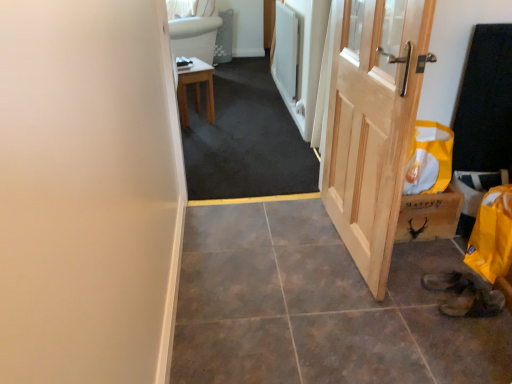
Locate an element on the screen. wooden stool at center is located at coordinates (195, 89).

The height and width of the screenshot is (384, 512). Describe the element at coordinates (181, 8) in the screenshot. I see `white fabric curtain at upper center` at that location.

This screenshot has width=512, height=384. What are the coordinates of `brown leather shoe at lower right` in the screenshot? It's located at (474, 303).

This screenshot has width=512, height=384. What do you see at coordinates (373, 123) in the screenshot?
I see `natural wood door at right` at bounding box center [373, 123].

Find the location of a particular element. wooden stool at center is located at coordinates (195, 89).

Which object is closer to the camera taking this photo, brown leather shoe at lower right or natural wood door at right?

Positioned in front is natural wood door at right.

Measure the distance from brown leather shoe at lower right to natural wood door at right.

They are 73.90 centimeters apart.

Which point is more distant from viewer, (439, 305) or (358, 56)?

The point (358, 56) is farther from the camera.

Is brown leather shoe at lower right at the right side of natural wood door at right?

Yes, brown leather shoe at lower right is to the right of natural wood door at right.

Is dark gray carpet at center in front of or behind white fabric curtain at upper center in the image?

Visually, dark gray carpet at center is located in front of white fabric curtain at upper center.

You are a GUI agent. You are given a task and a screenshot of the screen. Output one action in this format:
    pyautogui.click(x=<x>, y=<y>)
    Task: Click on the curtain behind the dark gray carpet at center
    The image size is (512, 384).
    Given the screenshot: What is the action you would take?
    pyautogui.click(x=181, y=8)

Is dark gray carpet at center oriented away from white fabric curtain at upper center?

That's right, dark gray carpet at center is facing away from white fabric curtain at upper center.

Is there a large distance between dark gray carpet at center and white fabric curtain at upper center?

Yes, dark gray carpet at center and white fabric curtain at upper center are located far from each other.

From a real-world perspective, is dark gray carpet at center under wooden stool at center?

Actually, dark gray carpet at center is physically above wooden stool at center in the real world.

Considering the sizes of objects dark gray carpet at center and wooden stool at center in the image provided, who is smaller, dark gray carpet at center or wooden stool at center?

wooden stool at center is smaller.

How distant is dark gray carpet at center from wooden stool at center?

They are 40.49 centimeters apart.

How different are the orientations of dark gray carpet at center and wooden stool at center in degrees?

dark gray carpet at center and wooden stool at center are facing 157 degrees away from each other.

From a real-world perspective, is brown leather shoe at lower right positioned over dark gray carpet at center based on gravity?

No, from a real-world perspective, brown leather shoe at lower right is not over dark gray carpet at center

Considering the positions of point (490, 305) and point (281, 111), is point (490, 305) closer or farther from the camera than point (281, 111)?

Point (490, 305).

Is brown leather shoe at lower right facing away from dark gray carpet at center?

No, brown leather shoe at lower right is not facing the opposite direction of dark gray carpet at center.

Is natural wood door at right outside of white fabric curtain at upper center?

natural wood door at right is positioned outside white fabric curtain at upper center.

Considering the relative sizes of natural wood door at right and white fabric curtain at upper center in the image provided, is natural wood door at right bigger than white fabric curtain at upper center?

Indeed, natural wood door at right has a larger size compared to white fabric curtain at upper center.

Does natural wood door at right turn towards white fabric curtain at upper center?

No, natural wood door at right does not turn towards white fabric curtain at upper center.

Between natural wood door at right and white fabric curtain at upper center, which one appears on the left side from the viewer's perspective?

From the viewer's perspective, white fabric curtain at upper center appears more on the left side.

Is natural wood door at right not inside dark gray carpet at center?

Yes, natural wood door at right is not within dark gray carpet at center.

Consider the image. From the image's perspective, which is below, natural wood door at right or dark gray carpet at center?

From the image's view, natural wood door at right is below.

Between natural wood door at right and dark gray carpet at center, which one has more height?

Standing taller between the two is natural wood door at right.

Is white fabric curtain at upper center looking in the opposite direction of dark gray carpet at center?

No.

Does point (185, 9) lie behind point (196, 175)?

Yes, it is behind point (196, 175).

Considering the positions of objects white fabric curtain at upper center and dark gray carpet at center in the image provided, who is more to the left, white fabric curtain at upper center or dark gray carpet at center?

white fabric curtain at upper center is more to the left.

Considering the sizes of objects white fabric curtain at upper center and dark gray carpet at center in the image provided, who is thinner, white fabric curtain at upper center or dark gray carpet at center?

white fabric curtain at upper center.

What are the coordinates of `door located on the left of brown leather shoe at lower right` in the screenshot? It's located at (373, 123).

You are a GUI agent. You are given a task and a screenshot of the screen. Output one action in this format:
    pyautogui.click(x=<x>, y=<y>)
    Task: Click on the curtain above the dark gray carpet at center (from a real-world perspective)
    This screenshot has height=384, width=512.
    Given the screenshot: What is the action you would take?
    pyautogui.click(x=181, y=8)

Based on their spatial positions, is white fabric curtain at upper center or natural wood door at right further from dark gray carpet at center?

Based on the image, white fabric curtain at upper center appears to be further to dark gray carpet at center.

Which object lies further to the anchor point dark gray carpet at center, wooden stool at center or natural wood door at right?

natural wood door at right is further to dark gray carpet at center.

From the image, which object appears to be farther from brown leather shoe at lower right, white fabric curtain at upper center or dark gray carpet at center?

Based on the image, white fabric curtain at upper center appears to be further to brown leather shoe at lower right.

Considering their positions, is dark gray carpet at center positioned closer to brown leather shoe at lower right than natural wood door at right?

Among the two, natural wood door at right is located nearer to brown leather shoe at lower right.

Consider the image. From the image, which object appears to be nearer to natural wood door at right, white fabric curtain at upper center or dark gray carpet at center?

dark gray carpet at center is positioned closer to the anchor natural wood door at right.

From the image, which object appears to be farther from dark gray carpet at center, brown leather shoe at lower right or white fabric curtain at upper center?

Based on the image, brown leather shoe at lower right appears to be further to dark gray carpet at center.

When comparing their distances from white fabric curtain at upper center, does brown leather shoe at lower right or dark gray carpet at center seem further?

The object further to white fabric curtain at upper center is brown leather shoe at lower right.

When comparing their distances from natural wood door at right, does white fabric curtain at upper center or brown leather shoe at lower right seem further?

white fabric curtain at upper center is positioned further to the anchor natural wood door at right.

Locate an element on the screen. The height and width of the screenshot is (384, 512). corridor positioned between brown leather shoe at lower right and wooden stool at center from near to far is located at coordinates (245, 139).

Identify the location of furniture between brown leather shoe at lower right and white fabric curtain at upper center in the front-back direction. This screenshot has width=512, height=384. (195, 89).

Find the location of a particular element. The height and width of the screenshot is (384, 512). furniture between natural wood door at right and white fabric curtain at upper center from front to back is located at coordinates (195, 89).

The width and height of the screenshot is (512, 384). What are the coordinates of `door between dark gray carpet at center and brown leather shoe at lower right vertically` in the screenshot? It's located at (373, 123).